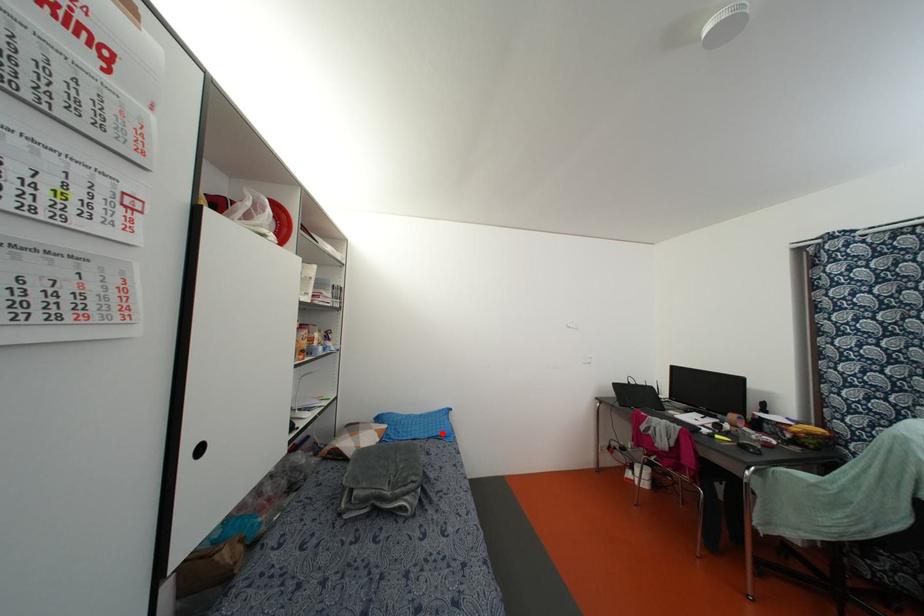
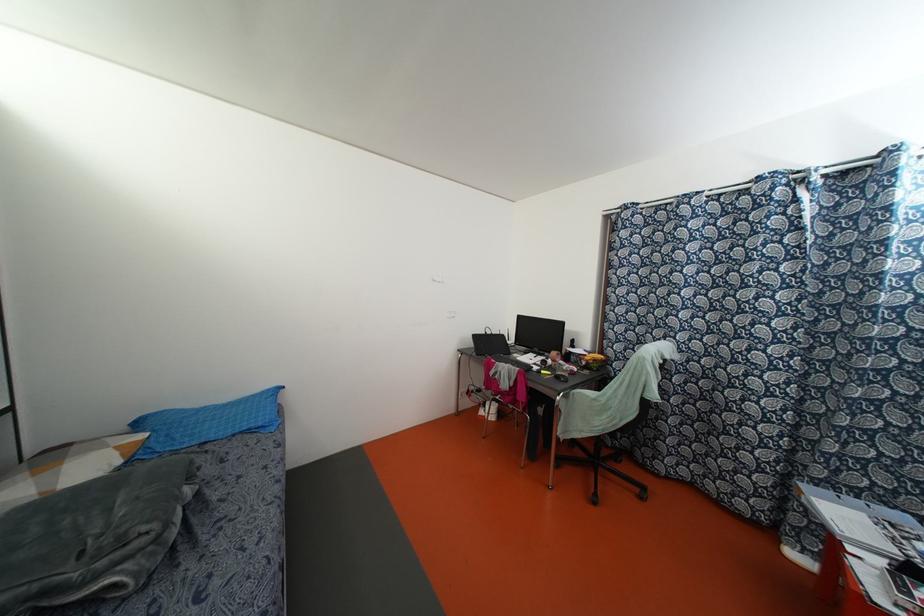
The point at the highlighted location is marked in the first image. Where is the corresponding point in the second image?

(259, 424)